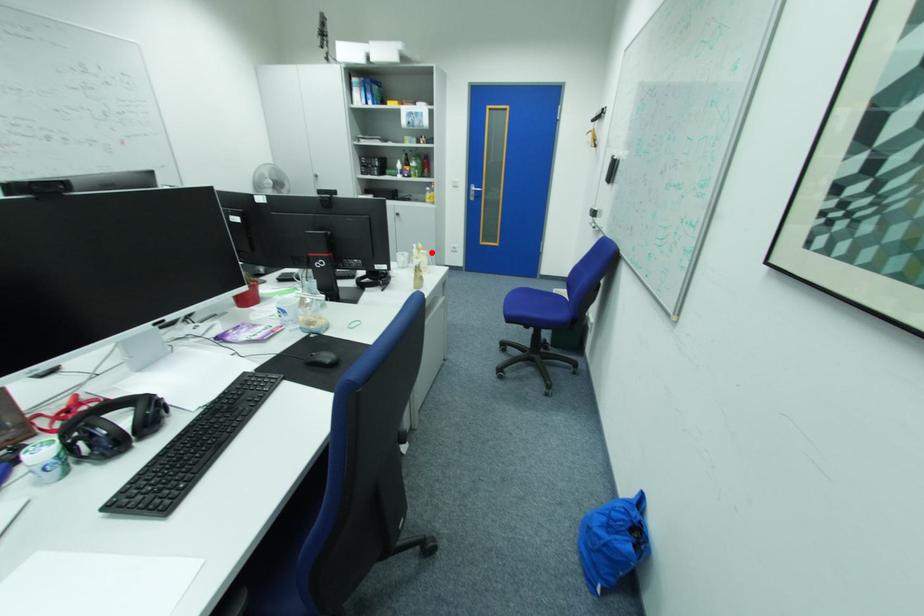
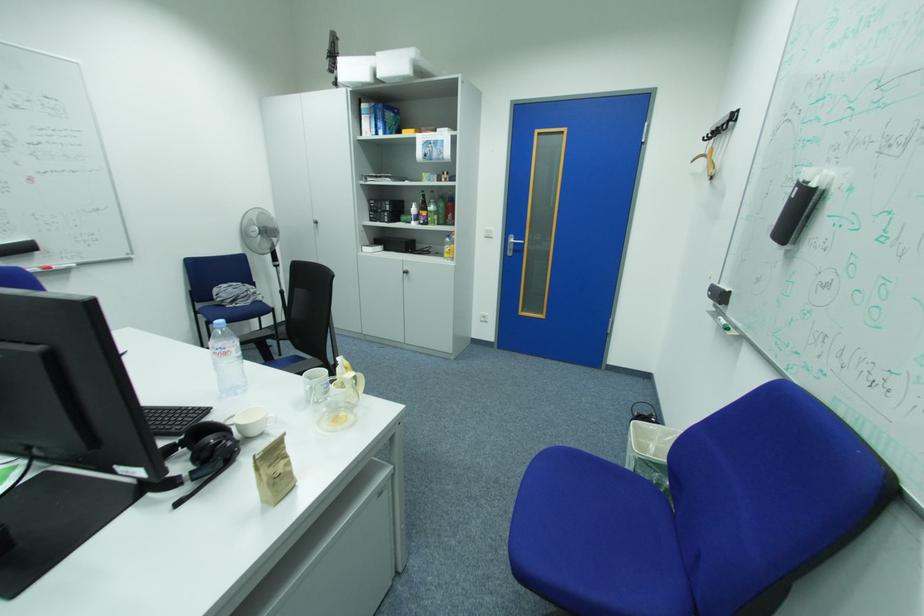
Question: I am providing you with two images of the same scene from different viewpoints. In image1, a red point is highlighted. Considering the same 3D point in image2, which of the following is correct?

Choices:
 (A) It is closer
 (B) It is farther

Answer: (A)